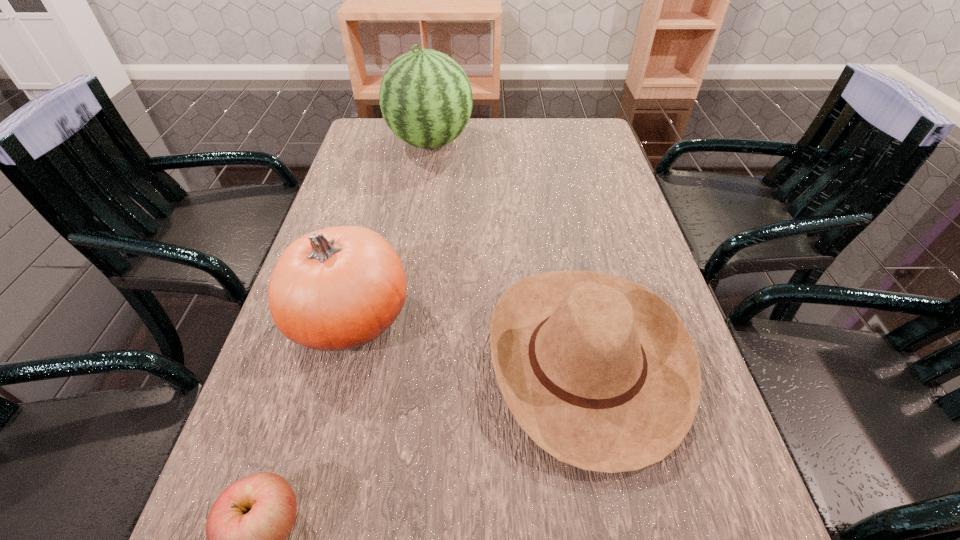
Where is `free spot between the second shortest object and the farthest object`? This screenshot has height=540, width=960. free spot between the second shortest object and the farthest object is located at coordinates (508, 251).

Where is `vacant space in between the second tallest object and the tallest object`? The height and width of the screenshot is (540, 960). vacant space in between the second tallest object and the tallest object is located at coordinates click(x=391, y=230).

This screenshot has height=540, width=960. In order to click on the second closest object to the pumpkin in this screenshot , I will do `click(247, 527)`.

The image size is (960, 540). Identify the location of object that is the second closest to the cowboy hat. (247, 527).